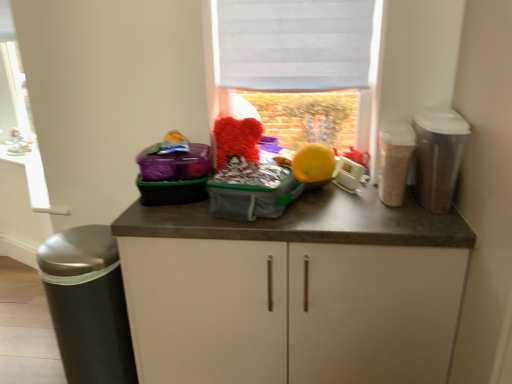
At what (x,y) coordinates should I click in order to perform the action: click on free space above white matte cabinet at center (from a real-world perspective). Please return your answer as a coordinate pair (x, y). Image resolution: width=512 pixels, height=384 pixels. Looking at the image, I should click on (252, 216).